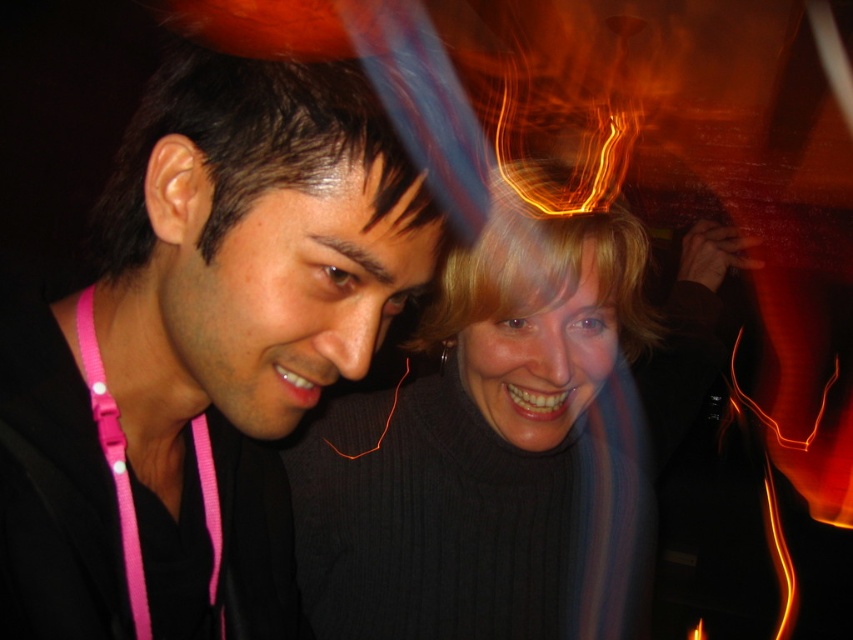
You are at a party and want to take a photo of the black ribbed sweater at center without the pink fabric lanyard at left appearing in the frame. Is it possible to do so by moving your camera position to the side?

The pink fabric lanyard at left is behind the black ribbed sweater at center, so moving the camera position to the side might allow you to capture the black ribbed sweater at center without the pink fabric lanyard at left in the frame, depending on their spatial arrangement.

You are a photographer trying to capture a closeup of the black matte jacket at left and the pink fabric lanyard at left. If your camera can only focus on objects within a 15 cm width, will both items fit in the frame?

The black matte jacket at left might be wider than pink fabric lanyard at left, so it is possible that the total width of both items exceeds 15 cm. Therefore, they might not both fit in the frame.

You are organizing a clothing donation drive and need to determine which item takes up more space when folded. Based on the image, which clothing item is wider between the black matte jacket at left and the black ribbed sweater at center?

The black ribbed sweater at center is wider than the black matte jacket at left, so it will take up more space when folded.